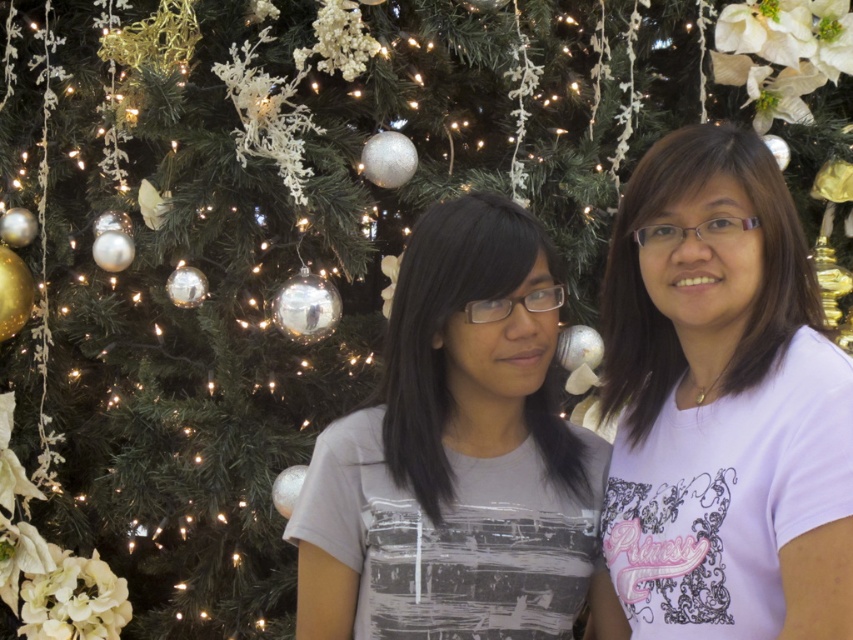
You are standing in front of the Christmas tree and want to hand a gift to the person wearing the white matte shirt at right. Based on their position, where should you walk to in order to reach them?

The white matte shirt at right is located at coordinates point (722, 403), so you should walk towards that position to reach them.

Consider the image. You are a photographer taking a picture of the white matte shirt at right and the gray matte shirt at center. Which shirt will appear larger in the photo?

The white matte shirt at right will appear larger in the photo because it is closer to the viewer than the gray matte shirt at center.

Based on the photo, you are organizing a Christmas photo shoot and need to ensure proper lighting. You have two subjects wearing the white matte shirt at right and the gray matte shirt at center. Based on their positions, which subject might require additional lighting to avoid appearing too dark in the photo?

The gray matte shirt at center might require additional lighting because it is positioned below the white matte shirt at right, potentially casting a shadow on it.